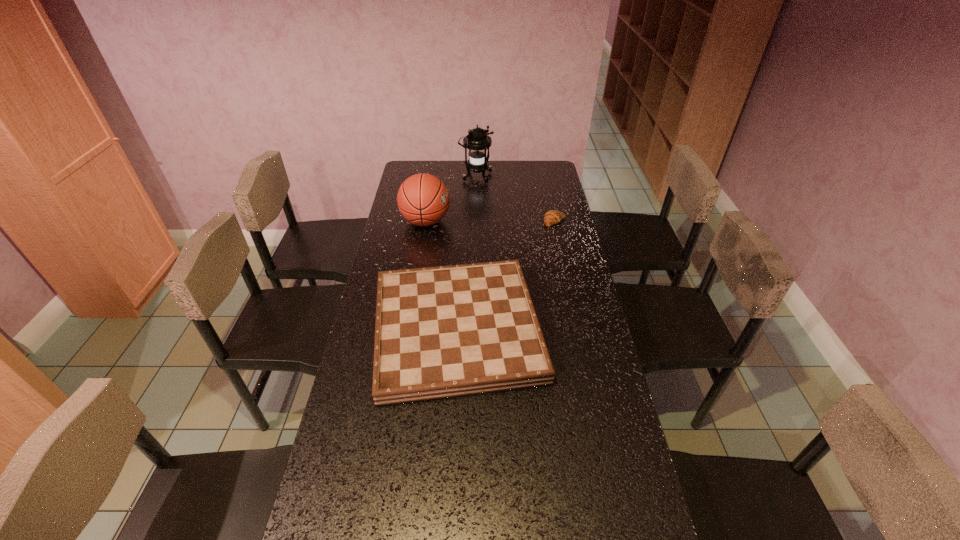
What are the coordinates of `the farthest object` in the screenshot? It's located at 477,141.

You are a GUI agent. You are given a task and a screenshot of the screen. Output one action in this format:
    pyautogui.click(x=<x>, y=<y>)
    Task: Click on the lantern
    The height and width of the screenshot is (540, 960).
    Given the screenshot: What is the action you would take?
    pyautogui.click(x=477, y=141)

Locate an element on the screen. the second tallest object is located at coordinates (423, 199).

Where is `the nearest object`? the nearest object is located at coordinates (442, 332).

Locate an element on the screen. The height and width of the screenshot is (540, 960). gameboard is located at coordinates (442, 332).

You are a GUI agent. You are given a task and a screenshot of the screen. Output one action in this format:
    pyautogui.click(x=<x>, y=<y>)
    Task: Click on the crescent roll
    This screenshot has height=540, width=960.
    Given the screenshot: What is the action you would take?
    pyautogui.click(x=552, y=217)

At what (x,y) coordinates should I click in order to perform the action: click on the rightmost object. Please return your answer as a coordinate pair (x, y). Looking at the image, I should click on (552, 217).

What are the coordinates of `vacant space located on the left of the farthest object` in the screenshot? It's located at (403, 177).

You are a GUI agent. You are given a task and a screenshot of the screen. Output one action in this format:
    pyautogui.click(x=<x>, y=<y>)
    Task: Click on the vacant region located on the logo side of the basketball
    The width and height of the screenshot is (960, 540).
    Given the screenshot: What is the action you would take?
    pyautogui.click(x=510, y=221)

Identify the location of vacant area located 0.380m on the back of the third tallest object. Image resolution: width=960 pixels, height=540 pixels. [463, 214].